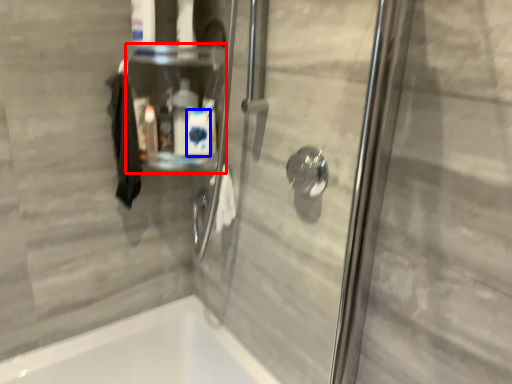
Question: Which object is closer to the camera taking this photo, shelf (highlighted by a red box) or cleaning product (highlighted by a blue box)?

Choices:
 (A) shelf
 (B) cleaning product

Answer: (A)